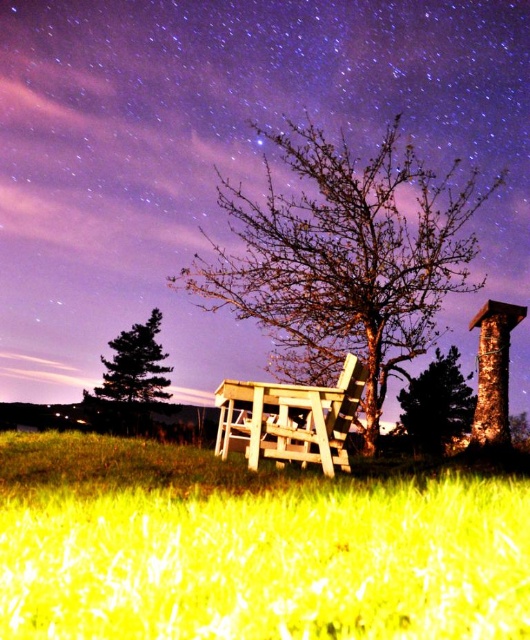
You are a photographer setting up equipment in the field. You have a green grass at lower center and a green textured tree at center in your view. Which object takes up less space in your photo?

The green grass at lower center takes up less space in the photo because it is smaller than the green textured tree at center.

You are planning to set up a telescope for stargazing. The telescope requires a clear line of sight and needs to be placed at least 5 meters away from any obstruction. Given the wooden table at center and the green textured tree at center, can you position the telescope between them without any obstruction?

The wooden table at center is 4.23 meters from the green textured tree at center. Since the telescope requires at least 5 meters of clearance, the distance between them is insufficient. Therefore, you cannot place the telescope between them without obstruction.

You are standing in the field looking at the scene. There are two points marked as point (127, 145) and point (413, 412). Which point is closer to you?

Point (127, 145) is further to the camera than point (413, 412), so the closer point to you is point (413, 412).